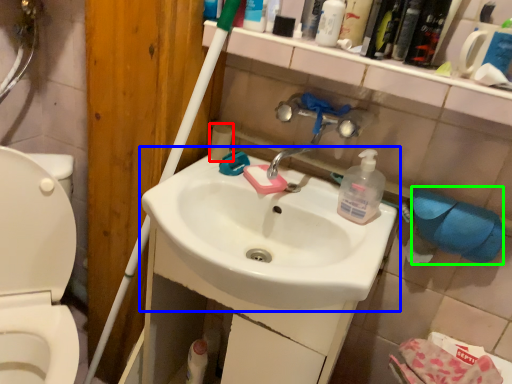
Question: Which is nearer to the toilet paper (highlighted by a red box)? sink (highlighted by a blue box) or toilet paper (highlighted by a green box).

Choices:
 (A) sink
 (B) toilet paper

Answer: (A)